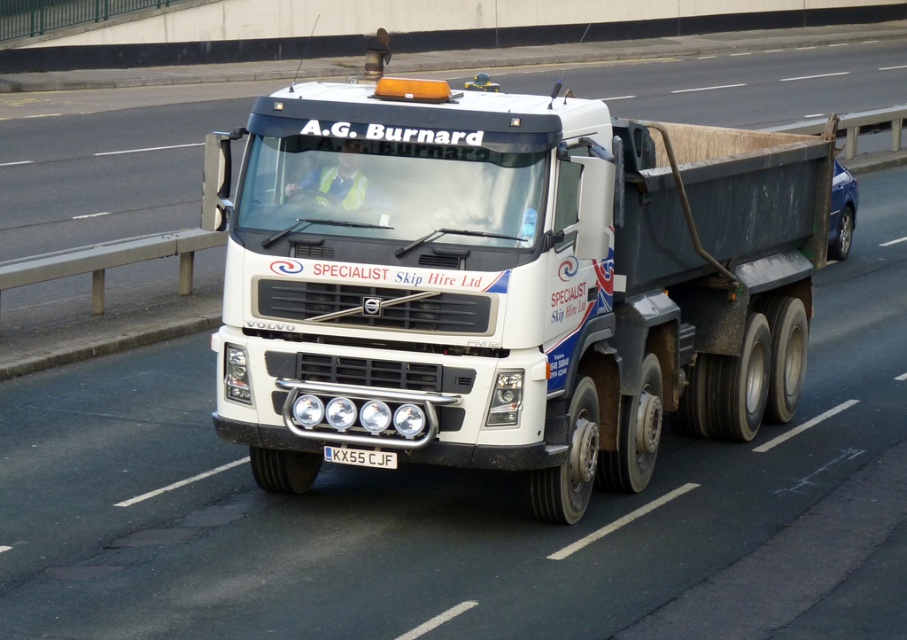
You are a delivery driver who needs to locate the white matte truck at center. According to the coordinates provided, where exactly is it positioned?

The white matte truck at center is located at coordinates point [506,282].

You are a traffic officer observing a Volvo FM4 truck from A.G. Burnard. You notice the white matte truck at center and the black metal license plate at center. Which object is positioned to the right side?

The white matte truck at center is positioned to the right of the black metal license plate at center.